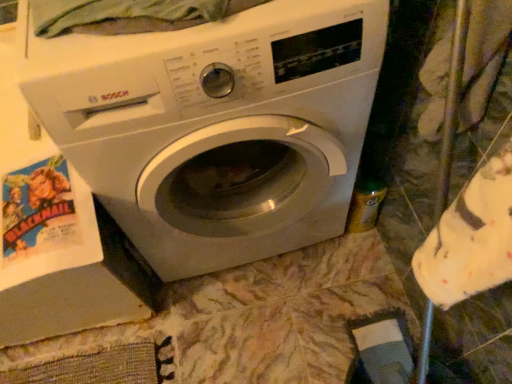
Identify the location of white glossy washing machine at center. (216, 126).

What do you see at coordinates (216, 126) in the screenshot?
I see `white glossy washing machine at center` at bounding box center [216, 126].

The image size is (512, 384). What are the coordinates of `white glossy washing machine at center` in the screenshot? It's located at (216, 126).